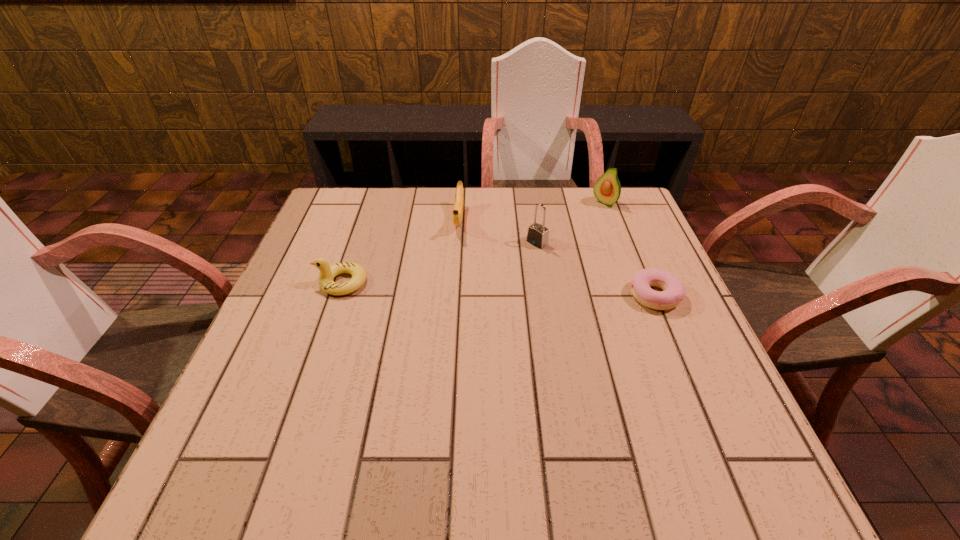
This screenshot has width=960, height=540. I want to click on vacant space positioned on the cut side of the avocado, so click(561, 244).

You are a GUI agent. You are given a task and a screenshot of the screen. Output one action in this format:
    pyautogui.click(x=<x>, y=<y>)
    Task: Click on the free spot located 0.190m on the shackle of the third object from right to left
    Image resolution: width=960 pixels, height=540 pixels.
    Given the screenshot: What is the action you would take?
    pyautogui.click(x=481, y=284)

At what (x,y) coordinates should I click in order to perform the action: click on free spot located 0.370m on the shackle of the third object from right to left. Please return your answer as a coordinate pair (x, y). Image resolution: width=960 pixels, height=540 pixels. Looking at the image, I should click on (424, 325).

Locate an element on the screen. The width and height of the screenshot is (960, 540). vacant space situated on the shackle of the third object from right to left is located at coordinates (418, 330).

This screenshot has width=960, height=540. Find the location of `free space located at the stem of the second object from left to right`. free space located at the stem of the second object from left to right is located at coordinates (446, 336).

Find the location of a particular element. Image resolution: width=960 pixels, height=540 pixels. free space located at the stem of the second object from left to right is located at coordinates (455, 260).

Find the location of a particular element. The image size is (960, 540). vacant point located at the stem of the second object from left to right is located at coordinates (454, 266).

Where is `avocado located at the far edge`? The image size is (960, 540). avocado located at the far edge is located at coordinates (607, 189).

Where is `banana that is at the far edge`? banana that is at the far edge is located at coordinates (457, 215).

Identify the location of object at the left edge. (327, 273).